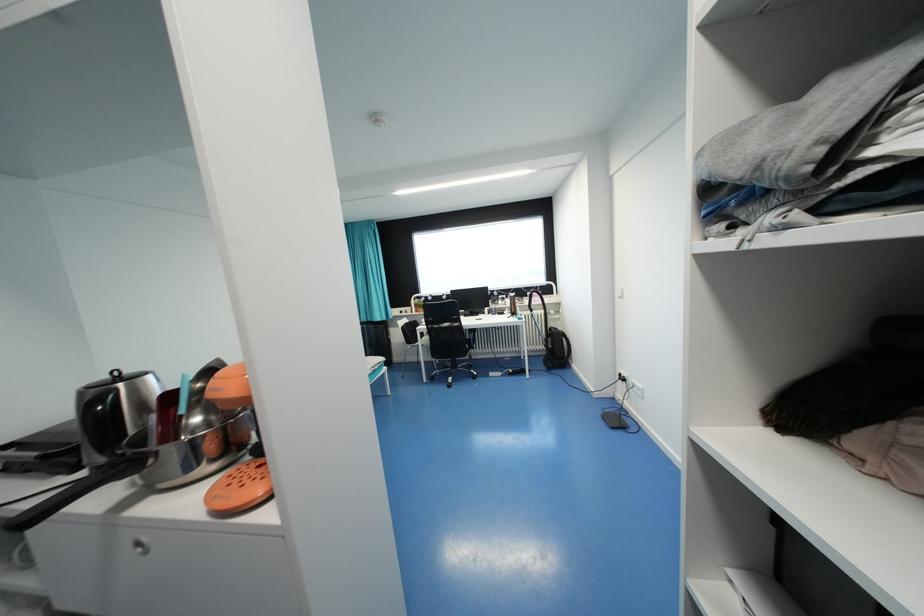
Find the location of a particular element. This screenshot has width=924, height=616. black pan handle is located at coordinates (77, 491).